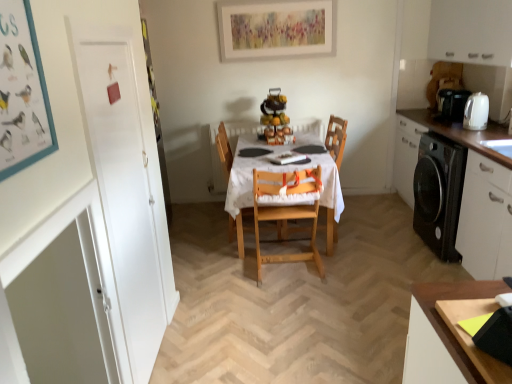
Where is `wooden chair at center`? This screenshot has height=384, width=512. wooden chair at center is located at coordinates (336, 138).

What do you see at coordinates (224, 150) in the screenshot? Image resolution: width=512 pixels, height=384 pixels. I see `wooden chair at center, positioned as the second chair in front-to-back order` at bounding box center [224, 150].

The image size is (512, 384). What do you see at coordinates (471, 31) in the screenshot?
I see `white matte cabinet at upper right, which is the 1th cabinetry in top-to-bottom order` at bounding box center [471, 31].

What is the approximate height of white matte cabinet at right, which appears as the 1th cabinetry when ordered from the bottom?

It is 36.42 inches.

What do you see at coordinates (452, 103) in the screenshot? I see `black plastic coffee machine at right` at bounding box center [452, 103].

This screenshot has height=384, width=512. In order to click on wooden chair at center in this screenshot , I will do `click(336, 138)`.

Does wooden table at center contain natural wood highchair at center, the 2th chair positioned from the back?

That's correct, natural wood highchair at center, the 2th chair positioned from the back, is inside wooden table at center.

From the image's perspective, who appears lower, wooden table at center or natural wood highchair at center, the 1th chair when ordered from front to back?

natural wood highchair at center, the 1th chair when ordered from front to back, appears lower in the image.

From a real-world perspective, between wooden table at center and natural wood highchair at center, the 2th chair positioned from the back, who is vertically higher?

natural wood highchair at center, the 2th chair positioned from the back, is physically above.

Looking at this image, between wooden table at center and white matte cabinet at upper right, positioned as the second cabinetry in bottom-to-top order, which one has larger width?

With larger width is wooden table at center.

Where is `the 1st cabinetry in front of the wooden table at center`? the 1st cabinetry in front of the wooden table at center is located at coordinates (471, 31).

Consider the image. Between wooden table at center and white matte cabinet at upper right, which is the 1th cabinetry in top-to-bottom order, which one has less height?

→ Standing shorter between the two is white matte cabinet at upper right, which is the 1th cabinetry in top-to-bottom order.

Can you tell me how much white matte cabinet at upper right, which is the 1th cabinetry in top-to-bottom order, and wooden chair at center, the first chair positioned from the back, differ in facing direction?

white matte cabinet at upper right, which is the 1th cabinetry in top-to-bottom order, and wooden chair at center, the first chair positioned from the back, are facing 180 degrees away from each other.

Is white matte cabinet at upper right, positioned as the second cabinetry in bottom-to-top order, next to wooden chair at center, positioned as the second chair in front-to-back order, and touching it?

No, white matte cabinet at upper right, positioned as the second cabinetry in bottom-to-top order, is not next to wooden chair at center, positioned as the second chair in front-to-back order.

Choose the correct answer: Is white matte cabinet at upper right, which is the 1th cabinetry in top-to-bottom order, inside wooden chair at center, positioned as the second chair in front-to-back order, or outside it?

white matte cabinet at upper right, which is the 1th cabinetry in top-to-bottom order, is located beyond the bounds of wooden chair at center, positioned as the second chair in front-to-back order.

Is point (490, 2) closer to viewer compared to point (227, 171)?

Yes, point (490, 2) is closer to viewer.

From a real-world perspective, between natural wood highchair at center, the 1th chair when ordered from front to back, and white matte cabinet at upper right, which is the 1th cabinetry in top-to-bottom order, who is vertically higher?

white matte cabinet at upper right, which is the 1th cabinetry in top-to-bottom order.

Does natural wood highchair at center, the 1th chair when ordered from front to back, turn towards white matte cabinet at upper right, which is the 1th cabinetry in top-to-bottom order?

No, natural wood highchair at center, the 1th chair when ordered from front to back, is not turned towards white matte cabinet at upper right, which is the 1th cabinetry in top-to-bottom order.

Based on their sizes in the image, would you say natural wood highchair at center, the 1th chair when ordered from front to back, is bigger or smaller than white matte cabinet at upper right, which is the 1th cabinetry in top-to-bottom order?

Clearly, natural wood highchair at center, the 1th chair when ordered from front to back, is smaller in size than white matte cabinet at upper right, which is the 1th cabinetry in top-to-bottom order.

Looking at this image, considering the positions of objects natural wood highchair at center, the 2th chair positioned from the back, and white matte cabinet at upper right, positioned as the second cabinetry in bottom-to-top order, in the image provided, who is in front, natural wood highchair at center, the 2th chair positioned from the back, or white matte cabinet at upper right, positioned as the second cabinetry in bottom-to-top order,?

white matte cabinet at upper right, positioned as the second cabinetry in bottom-to-top order, is in front.

From the image's perspective, is wooden chair at center, the first chair positioned from the back, located beneath white matte cabinet at upper right, which is the 1th cabinetry in top-to-bottom order?

Yes, from the image's perspective, wooden chair at center, the first chair positioned from the back, is beneath white matte cabinet at upper right, which is the 1th cabinetry in top-to-bottom order.

Is wooden chair at center, the first chair positioned from the back, taller than white matte cabinet at upper right, positioned as the second cabinetry in bottom-to-top order?

Correct, wooden chair at center, the first chair positioned from the back, is much taller as white matte cabinet at upper right, positioned as the second cabinetry in bottom-to-top order.

Does wooden chair at center, the first chair positioned from the back, appear on the right side of white matte cabinet at upper right, positioned as the second cabinetry in bottom-to-top order?

In fact, wooden chair at center, the first chair positioned from the back, is to the left of white matte cabinet at upper right, positioned as the second cabinetry in bottom-to-top order.

Is white matte cabinet at upper right, which is the 1th cabinetry in top-to-bottom order, next to black plastic coffee machine at right and touching it?

No, white matte cabinet at upper right, which is the 1th cabinetry in top-to-bottom order, is not making contact with black plastic coffee machine at right.

From the image's perspective, which one is positioned higher, white matte cabinet at upper right, positioned as the second cabinetry in bottom-to-top order, or black plastic coffee machine at right?

white matte cabinet at upper right, positioned as the second cabinetry in bottom-to-top order.

Is white matte cabinet at upper right, positioned as the second cabinetry in bottom-to-top order, shorter than black plastic coffee machine at right?

No, white matte cabinet at upper right, positioned as the second cabinetry in bottom-to-top order, is not shorter than black plastic coffee machine at right.

Considering the positions of objects black plastic coffee machine at right and natural wood highchair at center, the 2th chair positioned from the back, in the image provided, who is behind, black plastic coffee machine at right or natural wood highchair at center, the 2th chair positioned from the back,?

black plastic coffee machine at right is further away from the camera.

Considering the positions of points (448, 104) and (257, 261), is point (448, 104) farther from camera compared to point (257, 261)?

Yes, it is.

From the image's perspective, is black plastic coffee machine at right beneath natural wood highchair at center, the 2th chair positioned from the back?

Incorrect, from the image's perspective, black plastic coffee machine at right is higher than natural wood highchair at center, the 2th chair positioned from the back.

Is black plastic coffee machine at right aimed at natural wood highchair at center, the 1th chair when ordered from front to back?

No, black plastic coffee machine at right is not aimed at natural wood highchair at center, the 1th chair when ordered from front to back.

At what (x,y) coordinates should I click in order to perform the action: click on the 1st chair located above the wooden table at center (from a real-world perspective). Please return your answer as a coordinate pair (x, y). Looking at the image, I should click on (287, 211).

From the wooden table at center, count 1st cabinetrys forward and point to it. Please provide its 2D coordinates.

[(471, 31)]

From the image, which object appears to be farther from white glossy kettle at right, wooden chair at center or natural wood highchair at center, the 2th chair positioned from the back?

The object further to white glossy kettle at right is natural wood highchair at center, the 2th chair positioned from the back.

Which object lies nearer to the anchor point wooden chair at center, white matte cabinet at right, which appears as the 1th cabinetry when ordered from the bottom, or natural wood highchair at center, the 2th chair positioned from the back?

natural wood highchair at center, the 2th chair positioned from the back, is closer to wooden chair at center.

When comparing their distances from black plastic coffee machine at right, does natural wood highchair at center, the 2th chair positioned from the back, or white matte cabinet at right, the 2th cabinetry in the top-to-bottom sequence, seem closer?

Based on the image, white matte cabinet at right, the 2th cabinetry in the top-to-bottom sequence, appears to be nearer to black plastic coffee machine at right.

Which object lies nearer to the anchor point natural wood highchair at center, the 2th chair positioned from the back, white matte cabinet at upper right, which is the 1th cabinetry in top-to-bottom order, or wooden table at center?

wooden table at center is positioned closer to the anchor natural wood highchair at center, the 2th chair positioned from the back.

Considering their positions, is wooden chair at center, the first chair positioned from the back, positioned further to black plastic coffee machine at right than wooden chair at center?

wooden chair at center, the first chair positioned from the back.

From the image, which object appears to be farther from natural wood highchair at center, the 2th chair positioned from the back, white glossy kettle at right or white matte cabinet at upper right, positioned as the second cabinetry in bottom-to-top order?

white matte cabinet at upper right, positioned as the second cabinetry in bottom-to-top order.

Which object lies nearer to the anchor point white matte cabinet at upper right, which is the 1th cabinetry in top-to-bottom order, black plastic coffee machine at right or white glossy kettle at right?

Based on the image, black plastic coffee machine at right appears to be nearer to white matte cabinet at upper right, which is the 1th cabinetry in top-to-bottom order.

Which object lies nearer to the anchor point wooden chair at center, the first chair positioned from the back, white matte cabinet at upper right, positioned as the second cabinetry in bottom-to-top order, or wooden chair at center?

Based on the image, wooden chair at center appears to be nearer to wooden chair at center, the first chair positioned from the back.

Where is `appliance between white matte cabinet at upper right, which is the 1th cabinetry in top-to-bottom order, and white matte cabinet at right, which appears as the 1th cabinetry when ordered from the bottom, in the up-down direction`? Image resolution: width=512 pixels, height=384 pixels. appliance between white matte cabinet at upper right, which is the 1th cabinetry in top-to-bottom order, and white matte cabinet at right, which appears as the 1th cabinetry when ordered from the bottom, in the up-down direction is located at coordinates (476, 112).

Identify the location of appliance located between natural wood highchair at center, the 1th chair when ordered from front to back, and white matte cabinet at right, the 2th cabinetry in the top-to-bottom sequence, in the left-right direction. (476, 112).

The image size is (512, 384). In order to click on armchair between wooden table at center and black plastic coffee machine at right in the horizontal direction in this screenshot , I will do `click(336, 138)`.

Where is `appliance between white matte cabinet at right, which appears as the 1th cabinetry when ordered from the bottom, and black plastic coffee machine at right in the front-back direction`? The image size is (512, 384). appliance between white matte cabinet at right, which appears as the 1th cabinetry when ordered from the bottom, and black plastic coffee machine at right in the front-back direction is located at coordinates click(476, 112).